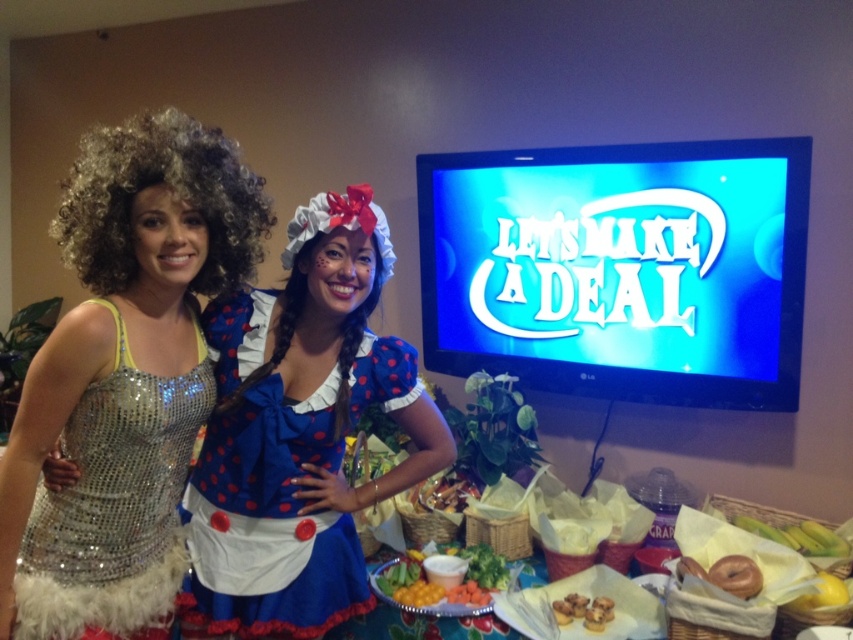
You are a photographer setting up for a photoshoot. You need to position a light source so that it illuminates the sparkly silver dress at left without casting a shadow on the vibrant orange carrot at center. Based on the scene description, where should you place the light source?

The sparkly silver dress at left is in front of the vibrant orange carrot at center. To avoid casting a shadow on the carrot, place the light source directly behind the sparkly silver dress at left so that its light shines forward, illuminating the dress while the carrot remains unobstructed.

You are a photographer setting up for a photoshoot. You need to ensure that the shiny sequined dress at left and the golden brown muffins at lower center are both visible in the frame. Given their sizes, which object should you focus on first to ensure proper framing?

The shiny sequined dress at left is bigger than the golden brown muffins at lower center, so you should focus on framing the shiny sequined dress at left first to ensure it fits properly, then adjust for the smaller golden brown muffins at lower center.